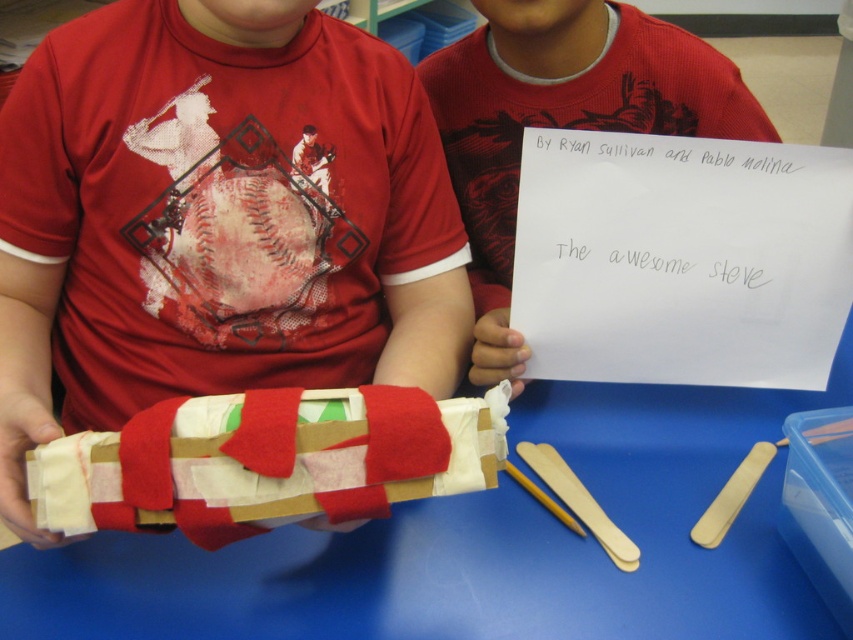
What is located at the coordinates point (267, 460)?

The felt wrapped book at center is located at point (267, 460).